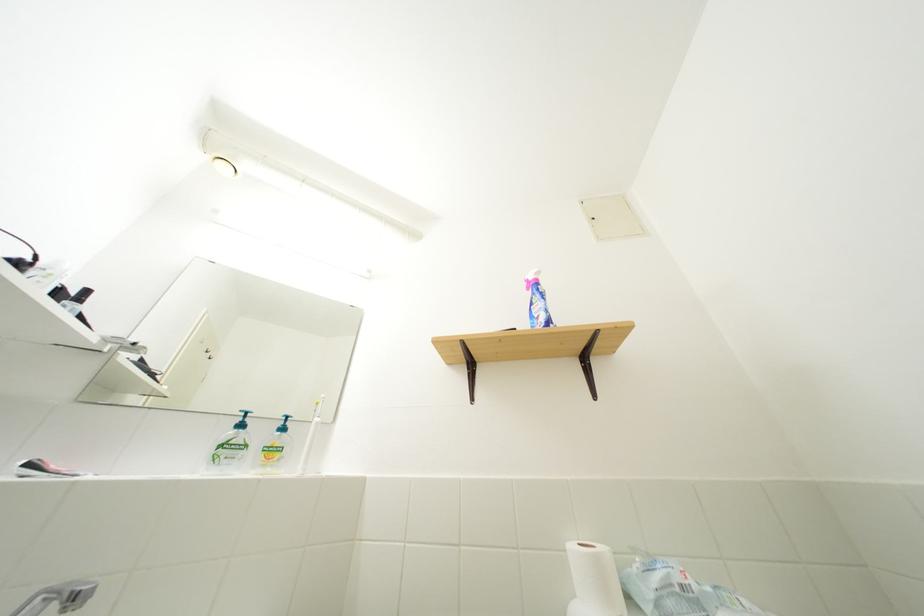
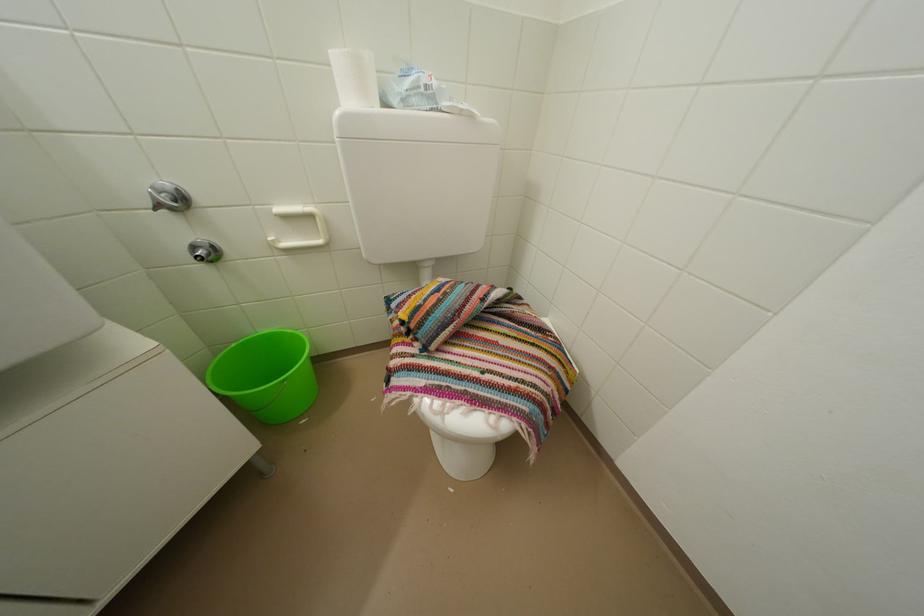
The images are taken continuously from a first-person perspective. In which direction is your viewpoint rotating?

The camera's rotation is toward right-down.